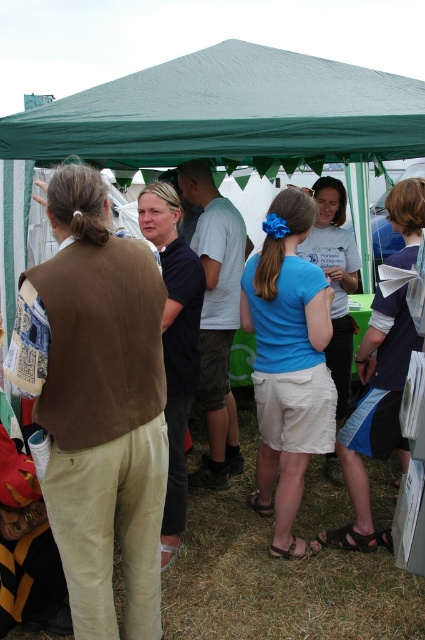
Question: Is green fabric canopy at upper center thinner than blue fabric tent at center?

Choices:
 (A) no
 (B) yes

Answer: (A)

Question: Among these objects, which one is farthest from the camera?

Choices:
 (A) blue fabric tent at center
 (B) green fabric canopy at upper center

Answer: (A)

Question: Which object appears closest to the camera in this image?

Choices:
 (A) blue fabric tent at center
 (B) green fabric canopy at upper center

Answer: (B)

Question: From the image, what is the correct spatial relationship of green fabric canopy at upper center in relation to blue fabric tent at center?

Choices:
 (A) below
 (B) above

Answer: (B)

Question: Is green fabric canopy at upper center further to camera compared to blue fabric tent at center?

Choices:
 (A) no
 (B) yes

Answer: (A)